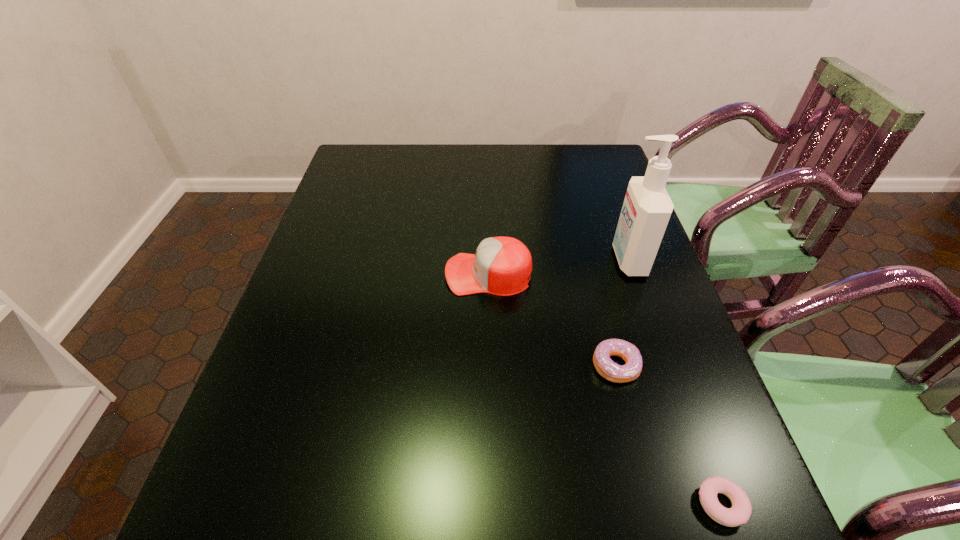
Where is `vacant space that is in between the tallest object and the second shortest object`? This screenshot has width=960, height=540. vacant space that is in between the tallest object and the second shortest object is located at coordinates (622, 313).

Identify the location of free space between the second tallest object and the cleansing agent. The image size is (960, 540). (559, 267).

Find the location of `free spot between the cleansing agent and the third shortest object`. free spot between the cleansing agent and the third shortest object is located at coordinates (559, 267).

Identify the location of object that is the third closest to the cleansing agent. (739, 513).

Locate which object ranks second in proximity to the leftmost object. Please provide its 2D coordinates. Your answer should be formatted as a tuple, i.e. [(x, y)], where the tuple contains the x and y coordinates of a point satisfying the conditions above.

[(647, 207)]

The image size is (960, 540). I want to click on free spot that satisfies the following two spatial constraints: 1. on the front-facing side of the right doughnut; 2. on the left side of the leftmost object, so click(x=492, y=504).

Where is `vacant space that satisfies the following two spatial constraints: 1. on the front label of the nearer doughnut; 2. on the left side of the cleansing agent`? vacant space that satisfies the following two spatial constraints: 1. on the front label of the nearer doughnut; 2. on the left side of the cleansing agent is located at coordinates (713, 504).

I want to click on vacant area that satisfies the following two spatial constraints: 1. on the front label of the tallest object; 2. on the left side of the shorter doughnut, so click(713, 504).

Where is `free point that satisfies the following two spatial constraints: 1. on the front-facing side of the baseball cap; 2. on the right side of the nearer doughnut`? This screenshot has height=540, width=960. free point that satisfies the following two spatial constraints: 1. on the front-facing side of the baseball cap; 2. on the right side of the nearer doughnut is located at coordinates (492, 504).

The image size is (960, 540). I want to click on free spot that satisfies the following two spatial constraints: 1. on the back side of the third farthest object; 2. on the front-facing side of the third shortest object, so click(x=592, y=274).